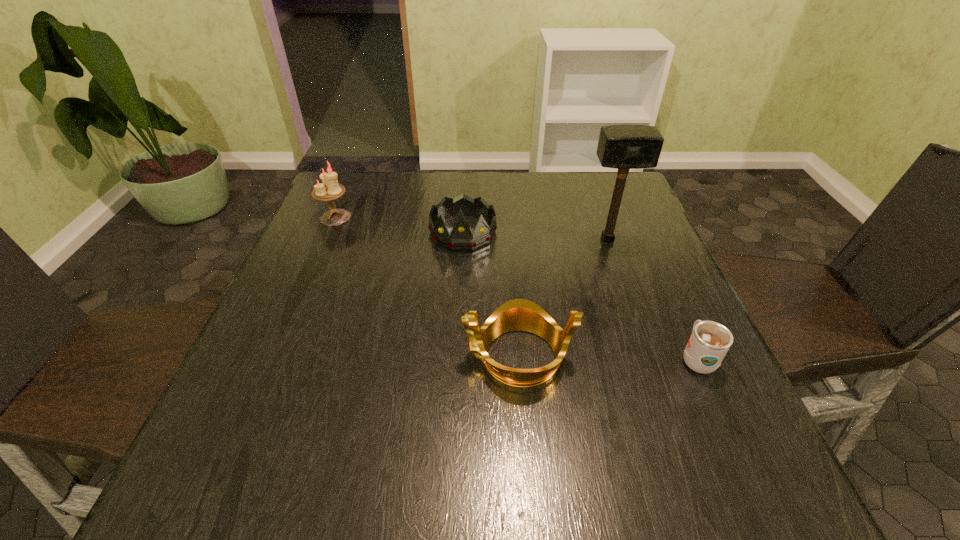
At what (x,y) coordinates should I click in order to perform the action: click on the tallest object. Please return your answer as a coordinate pair (x, y). Image resolution: width=960 pixels, height=540 pixels. Looking at the image, I should click on (624, 147).

Identify the location of the leftmost object. (330, 189).

At what (x,y) coordinates should I click in order to perform the action: click on candle holder. Please return your answer as a coordinate pair (x, y). This screenshot has width=960, height=540. Looking at the image, I should click on (330, 189).

I want to click on the farther tiara, so click(461, 238).

Where is `the nearer tiara`? the nearer tiara is located at coordinates (518, 314).

Find the location of a particular element. This screenshot has height=540, width=960. cup is located at coordinates (710, 341).

This screenshot has width=960, height=540. I want to click on vacant area located 0.170m on the left of the tallest object, so click(x=516, y=239).

In order to click on free region located on the back of the second tallest object in this screenshot , I will do `click(353, 174)`.

Where is `vacant region located 0.320m at the front of the farther tiara with jewels`? The image size is (960, 540). vacant region located 0.320m at the front of the farther tiara with jewels is located at coordinates (457, 360).

Image resolution: width=960 pixels, height=540 pixels. Find the location of `vacant space located at the front emblem of the nearer tiara`. vacant space located at the front emblem of the nearer tiara is located at coordinates (274, 356).